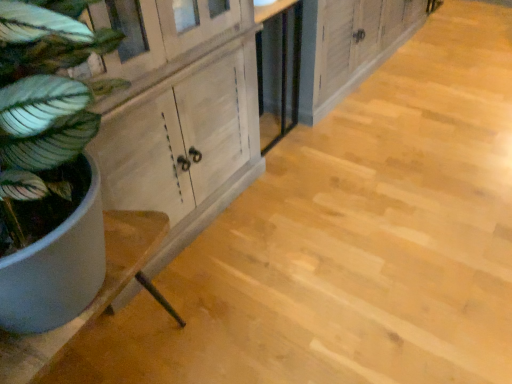
Question: Could you tell me if green matte plant at left is facing wooden cabinet at center?

Choices:
 (A) yes
 (B) no

Answer: (B)

Question: Can you confirm if green matte plant at left is thinner than wooden cabinet at center?

Choices:
 (A) yes
 (B) no

Answer: (B)

Question: Is the depth of green matte plant at left less than that of wooden cabinet at center?

Choices:
 (A) no
 (B) yes

Answer: (B)

Question: Is green matte plant at left located outside wooden cabinet at center?

Choices:
 (A) yes
 (B) no

Answer: (A)

Question: Does green matte plant at left have a greater width compared to wooden cabinet at center?

Choices:
 (A) yes
 (B) no

Answer: (A)

Question: Considering the positions of point (392, 19) and point (24, 352), is point (392, 19) closer or farther from the camera than point (24, 352)?

Choices:
 (A) farther
 (B) closer

Answer: (A)

Question: Considering the positions of wooden cabinet at center and white wood counter at left in the image, is wooden cabinet at center bigger or smaller than white wood counter at left?

Choices:
 (A) small
 (B) big

Answer: (B)

Question: Do you think wooden cabinet at center is within white wood counter at left, or outside of it?

Choices:
 (A) inside
 (B) outside

Answer: (B)

Question: In terms of height, does wooden cabinet at center look taller or shorter compared to white wood counter at left?

Choices:
 (A) tall
 (B) short

Answer: (A)

Question: In terms of height, does green matte plant at left look taller or shorter compared to white wood counter at left?

Choices:
 (A) short
 (B) tall

Answer: (B)

Question: From the image's perspective, is green matte plant at left above or below white wood counter at left?

Choices:
 (A) above
 (B) below

Answer: (A)

Question: Looking at their shapes, would you say green matte plant at left is wider or thinner than white wood counter at left?

Choices:
 (A) thin
 (B) wide

Answer: (B)

Question: From a real-world perspective, is green matte plant at left physically located above or below white wood counter at left?

Choices:
 (A) above
 (B) below

Answer: (A)

Question: Based on their sizes in the image, would you say white wood counter at left is bigger or smaller than wooden cabinet at center?

Choices:
 (A) small
 (B) big

Answer: (A)

Question: Considering the positions of point (128, 264) and point (384, 14), is point (128, 264) closer or farther from the camera than point (384, 14)?

Choices:
 (A) closer
 (B) farther

Answer: (A)